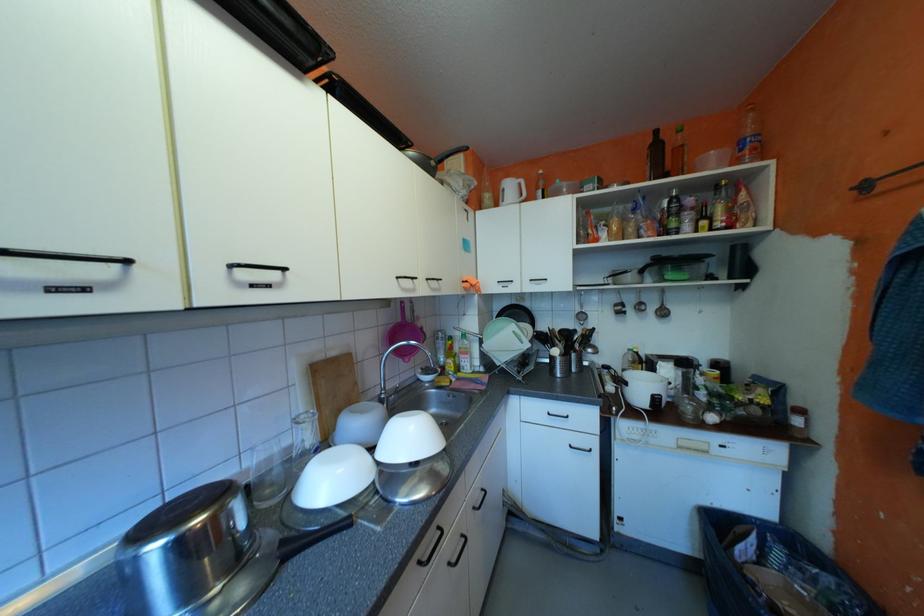
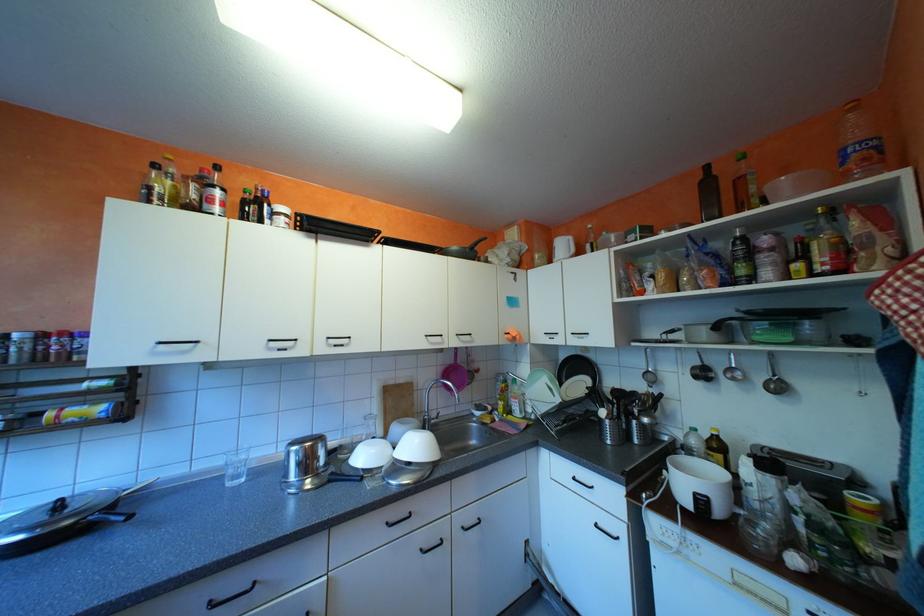
Where in the second image is the point corresponding to point (627, 304) from the first image?

(706, 367)